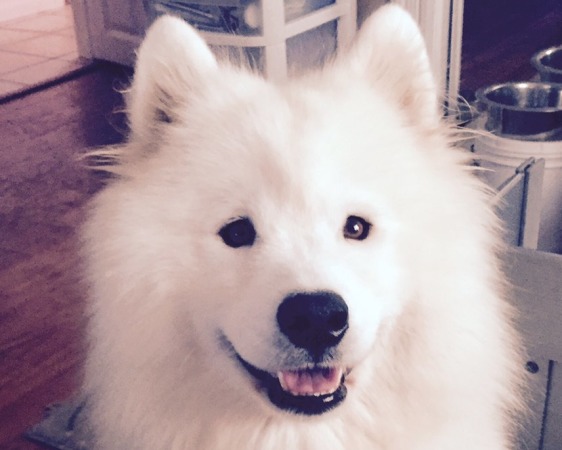
I want to click on doorway, so click(442, 16).